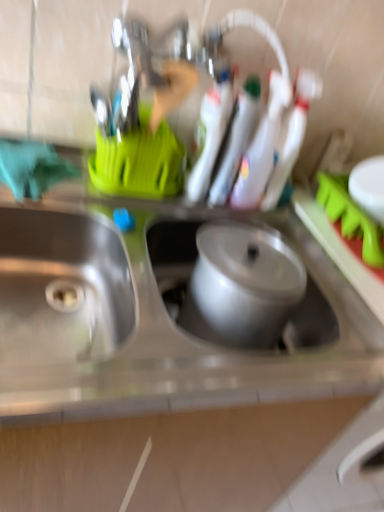
In order to face metallic silver pot at center, which is the first sink from right to left, should I rotate leftwards or rightwards?

You should look right and rotate roughly 6.050 degrees.

Image resolution: width=384 pixels, height=512 pixels. Identify the location of metallic silver pot at center, which is the first sink from right to left. click(173, 258).

What is the approximate height of metallic silver pot at center, acting as the second sink starting from the left?

It is 7.40 inches.

What do you see at coordinates (173, 258) in the screenshot? I see `metallic silver pot at center, acting as the second sink starting from the left` at bounding box center [173, 258].

You are a GUI agent. You are given a task and a screenshot of the screen. Output one action in this format:
    pyautogui.click(x=<x>, y=<y>)
    Task: Click on the stainless steel sink at left, the second sink in the right-to-left sequence
    The width and height of the screenshot is (384, 512).
    Given the screenshot: What is the action you would take?
    pyautogui.click(x=62, y=287)

The height and width of the screenshot is (512, 384). Describe the element at coordinates (62, 287) in the screenshot. I see `stainless steel sink at left, arranged as the 1th sink when viewed from the left` at that location.

What is the approximate height of stainless steel sink at left, the second sink in the right-to-left sequence?

stainless steel sink at left, the second sink in the right-to-left sequence, is 8.20 inches tall.

What is the approximate width of stainless steel sink at left, the second sink in the right-to-left sequence?

The width of stainless steel sink at left, the second sink in the right-to-left sequence, is 13.99 inches.

Image resolution: width=384 pixels, height=512 pixels. In order to click on metallic silver pot at center, which is the first sink from right to left in this screenshot , I will do `click(173, 258)`.

Visually, is stainless steel sink at left, the second sink in the right-to-left sequence, positioned to the left or to the right of metallic silver pot at center, which is the first sink from right to left?

From the image, it's evident that stainless steel sink at left, the second sink in the right-to-left sequence, is to the left of metallic silver pot at center, which is the first sink from right to left.

Is stainless steel sink at left, the second sink in the right-to-left sequence, in front of or behind metallic silver pot at center, which is the first sink from right to left, in the image?

Clearly, stainless steel sink at left, the second sink in the right-to-left sequence, is in front of metallic silver pot at center, which is the first sink from right to left.

Is point (46, 358) closer to viewer compared to point (318, 339)?

Yes, point (46, 358) is closer to viewer.

From the image's perspective, would you say stainless steel sink at left, arranged as the 1th sink when viewed from the left, is positioned over metallic silver pot at center, acting as the second sink starting from the left?

Incorrect, from the image's perspective, stainless steel sink at left, arranged as the 1th sink when viewed from the left, is lower than metallic silver pot at center, acting as the second sink starting from the left.

From a real-world perspective, is stainless steel sink at left, the second sink in the right-to-left sequence, located beneath metallic silver pot at center, acting as the second sink starting from the left?

Yes, from a real-world perspective, stainless steel sink at left, the second sink in the right-to-left sequence, is beneath metallic silver pot at center, acting as the second sink starting from the left.

Looking at this image, between stainless steel sink at left, arranged as the 1th sink when viewed from the left, and metallic silver pot at center, acting as the second sink starting from the left, which one has smaller width?

With smaller width is metallic silver pot at center, acting as the second sink starting from the left.

From the picture: In terms of height, does stainless steel sink at left, arranged as the 1th sink when viewed from the left, look taller or shorter compared to metallic silver pot at center, acting as the second sink starting from the left?

Considering their sizes, stainless steel sink at left, arranged as the 1th sink when viewed from the left, has more height than metallic silver pot at center, acting as the second sink starting from the left.

Looking at the image, does stainless steel sink at left, arranged as the 1th sink when viewed from the left, seem bigger or smaller compared to metallic silver pot at center, acting as the second sink starting from the left?

Clearly, stainless steel sink at left, arranged as the 1th sink when viewed from the left, is larger in size than metallic silver pot at center, acting as the second sink starting from the left.

Is metallic silver pot at center, which is the first sink from right to left, surrounded by stainless steel sink at left, the second sink in the right-to-left sequence?

That's incorrect, metallic silver pot at center, which is the first sink from right to left, is not inside stainless steel sink at left, the second sink in the right-to-left sequence.

Is stainless steel sink at left, arranged as the 1th sink when viewed from the left, far away from metallic silver pot at center, which is the first sink from right to left?

stainless steel sink at left, arranged as the 1th sink when viewed from the left, is actually quite close to metallic silver pot at center, which is the first sink from right to left.

Is stainless steel sink at left, the second sink in the right-to-left sequence, aimed at metallic silver pot at center, which is the first sink from right to left?

No, stainless steel sink at left, the second sink in the right-to-left sequence, does not turn towards metallic silver pot at center, which is the first sink from right to left.

Where is `sink above the stainless steel sink at left, arranged as the 1th sink when viewed from the left (from a real-world perspective)`? The image size is (384, 512). sink above the stainless steel sink at left, arranged as the 1th sink when viewed from the left (from a real-world perspective) is located at coordinates (173, 258).

Is metallic silver pot at center, which is the first sink from right to left, to the right of stainless steel sink at left, arranged as the 1th sink when viewed from the left, from the viewer's perspective?

Yes.

Relative to stainless steel sink at left, the second sink in the right-to-left sequence, is metallic silver pot at center, acting as the second sink starting from the left, in front or behind?

Clearly, metallic silver pot at center, acting as the second sink starting from the left, is behind stainless steel sink at left, the second sink in the right-to-left sequence.

Is point (193, 231) closer or farther from the camera than point (71, 355)?

Point (193, 231) is positioned farther from the camera compared to point (71, 355).

From the image's perspective, is metallic silver pot at center, acting as the second sink starting from the left, positioned above or below stainless steel sink at left, the second sink in the right-to-left sequence?

Based on their image positions, metallic silver pot at center, acting as the second sink starting from the left, is located above stainless steel sink at left, the second sink in the right-to-left sequence.

From a real-world perspective, is metallic silver pot at center, acting as the second sink starting from the left, positioned under stainless steel sink at left, arranged as the 1th sink when viewed from the left, based on gravity?

No, from a real-world perspective, metallic silver pot at center, acting as the second sink starting from the left, is not below stainless steel sink at left, arranged as the 1th sink when viewed from the left.

Which object is wider, metallic silver pot at center, acting as the second sink starting from the left, or stainless steel sink at left, the second sink in the right-to-left sequence?

Wider between the two is stainless steel sink at left, the second sink in the right-to-left sequence.

Based on the photo, does metallic silver pot at center, acting as the second sink starting from the left, have a lesser height compared to stainless steel sink at left, the second sink in the right-to-left sequence?

Correct, metallic silver pot at center, acting as the second sink starting from the left, is not as tall as stainless steel sink at left, the second sink in the right-to-left sequence.

Considering the sizes of objects metallic silver pot at center, acting as the second sink starting from the left, and stainless steel sink at left, the second sink in the right-to-left sequence, in the image provided, who is smaller, metallic silver pot at center, acting as the second sink starting from the left, or stainless steel sink at left, the second sink in the right-to-left sequence,?

Smaller between the two is metallic silver pot at center, acting as the second sink starting from the left.

Is metallic silver pot at center, acting as the second sink starting from the left, surrounding stainless steel sink at left, arranged as the 1th sink when viewed from the left?

No, stainless steel sink at left, arranged as the 1th sink when viewed from the left, is located outside of metallic silver pot at center, acting as the second sink starting from the left.

Is metallic silver pot at center, acting as the second sink starting from the left, not close to stainless steel sink at left, the second sink in the right-to-left sequence?

No, there isn't a large distance between metallic silver pot at center, acting as the second sink starting from the left, and stainless steel sink at left, the second sink in the right-to-left sequence.

Could you tell me if metallic silver pot at center, acting as the second sink starting from the left, is turned towards stainless steel sink at left, the second sink in the right-to-left sequence?

No.

The height and width of the screenshot is (512, 384). In the image, there is a metallic silver pot at center, acting as the second sink starting from the left. Identify the location of sink below it (from a real-world perspective). (62, 287).

Image resolution: width=384 pixels, height=512 pixels. I want to click on sink on the right of stainless steel sink at left, the second sink in the right-to-left sequence, so click(173, 258).

At what (x,y) coordinates should I click in order to perform the action: click on sink located behind the stainless steel sink at left, the second sink in the right-to-left sequence. Please return your answer as a coordinate pair (x, y). Looking at the image, I should click on (173, 258).